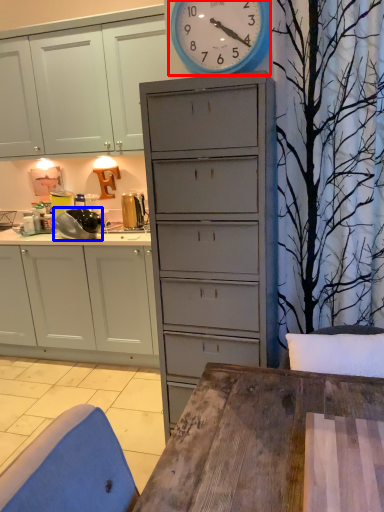
Question: Among these objects, which one is farthest to the camera, wall clock (highlighted by a red box) or appliance (highlighted by a blue box)?

Choices:
 (A) wall clock
 (B) appliance

Answer: (B)